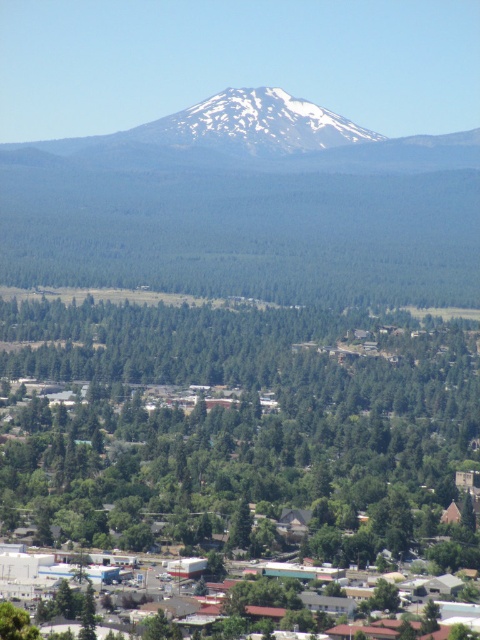
You are standing at the base of the snow capped mountain and want to reach the point marked as point (9, 518). Considering the mountain is steep and rugged, do you think you can walk directly to that point from your current position?

The distance between point (9, 518) and the viewer is 665.55 meters. However, the mountain is described as steep and rugged, which may make the path challenging or impassable. Therefore, it might not be feasible to walk directly to that point from your current position due to the mountain terrain.